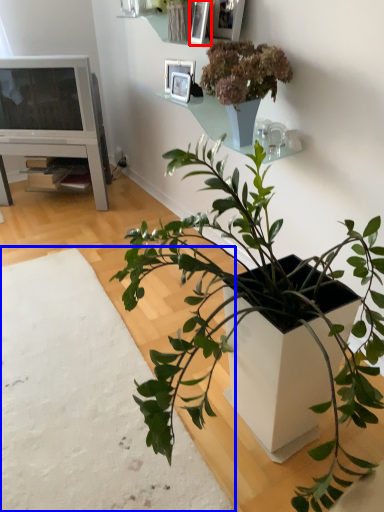
Question: Which object is closer to the camera taking this photo, picture frame (highlighted by a red box) or plain (highlighted by a blue box)?

Choices:
 (A) picture frame
 (B) plain

Answer: (B)